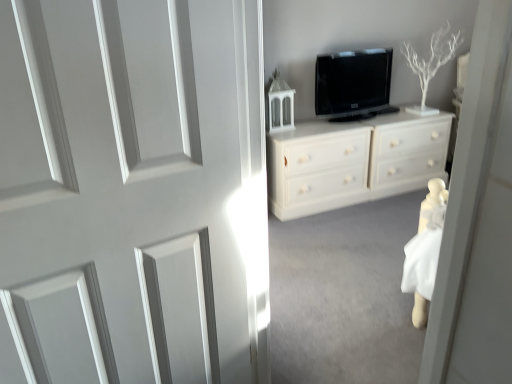
Question: Is black glossy tv at upper center to the left of white painted wood door at center from the viewer's perspective?

Choices:
 (A) no
 (B) yes

Answer: (A)

Question: Could you tell me if black glossy tv at upper center is facing white painted wood door at center?

Choices:
 (A) no
 (B) yes

Answer: (A)

Question: Is black glossy tv at upper center outside white painted wood door at center?

Choices:
 (A) yes
 (B) no

Answer: (A)

Question: Is black glossy tv at upper center facing away from white painted wood door at center?

Choices:
 (A) yes
 (B) no

Answer: (B)

Question: From a real-world perspective, is black glossy tv at upper center under white painted wood door at center?

Choices:
 (A) no
 (B) yes

Answer: (A)

Question: Is black glossy tv at upper center thinner than white painted wood door at center?

Choices:
 (A) no
 (B) yes

Answer: (B)

Question: Does black glossy tv at upper center appear on the left side of white painted wood chest of drawers at center?

Choices:
 (A) yes
 (B) no

Answer: (A)

Question: Is the position of black glossy tv at upper center more distant than that of white painted wood chest of drawers at center?

Choices:
 (A) no
 (B) yes

Answer: (B)

Question: Can you confirm if black glossy tv at upper center is smaller than white painted wood chest of drawers at center?

Choices:
 (A) no
 (B) yes

Answer: (B)

Question: Can you confirm if black glossy tv at upper center is wider than white painted wood chest of drawers at center?

Choices:
 (A) yes
 (B) no

Answer: (B)

Question: From the image's perspective, is black glossy tv at upper center beneath white painted wood chest of drawers at center?

Choices:
 (A) yes
 (B) no

Answer: (B)

Question: From the image's perspective, is black glossy tv at upper center on white painted wood chest of drawers at center?

Choices:
 (A) yes
 (B) no

Answer: (A)

Question: From the image's perspective, is white painted wood chest of drawers at center under black glossy tv at upper center?

Choices:
 (A) yes
 (B) no

Answer: (A)